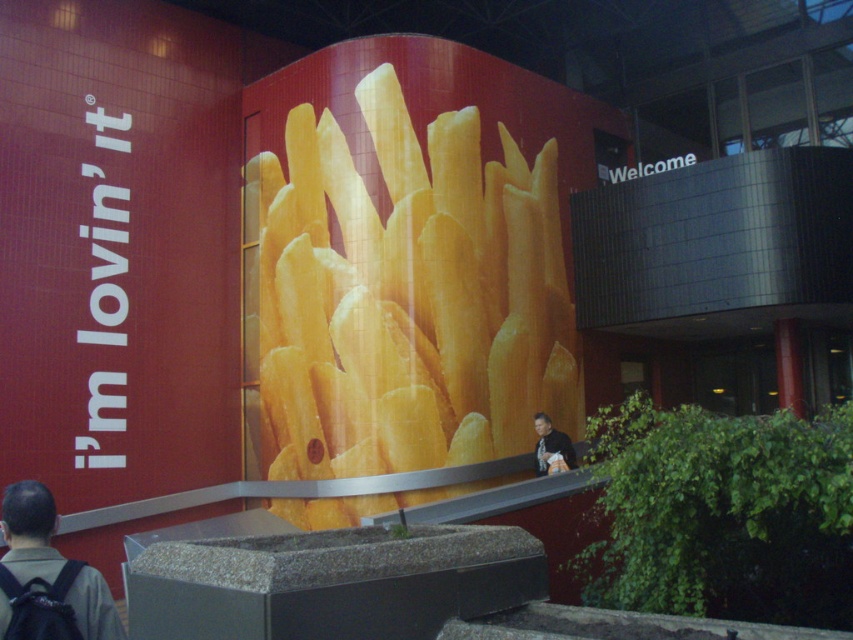
Who is positioned more to the left, golden crispy french fries at center or light brown leather jacket at lower center?

light brown leather jacket at lower center

Is golden crispy french fries at center behind light brown leather jacket at lower center?

Yes, golden crispy french fries at center is further from the viewer.

Where is `golden crispy french fries at center`? The width and height of the screenshot is (853, 640). golden crispy french fries at center is located at coordinates (407, 296).

The height and width of the screenshot is (640, 853). What are the coordinates of `golden crispy french fries at center` in the screenshot? It's located at (407, 296).

Who is higher up, dark gray backpack at lower left or light brown leather jacket at lower center?

dark gray backpack at lower left is higher up.

Does dark gray backpack at lower left come in front of light brown leather jacket at lower center?

Yes, it is in front of light brown leather jacket at lower center.

The image size is (853, 640). What are the coordinates of `dark gray backpack at lower left` in the screenshot? It's located at (47, 577).

You are a GUI agent. You are given a task and a screenshot of the screen. Output one action in this format:
    pyautogui.click(x=<x>, y=<y>)
    Task: Click on the dark gray backpack at lower left
    
    Given the screenshot: What is the action you would take?
    pyautogui.click(x=47, y=577)

Is golden crispy french fries at center taller than dark gray backpack at lower left?

Yes, golden crispy french fries at center is taller than dark gray backpack at lower left.

Which of these two, golden crispy french fries at center or dark gray backpack at lower left, stands taller?

golden crispy french fries at center

The width and height of the screenshot is (853, 640). What do you see at coordinates (407, 296) in the screenshot? I see `golden crispy french fries at center` at bounding box center [407, 296].

At what (x,y) coordinates should I click in order to perform the action: click on golden crispy french fries at center. Please return your answer as a coordinate pair (x, y). The width and height of the screenshot is (853, 640). Looking at the image, I should click on (407, 296).